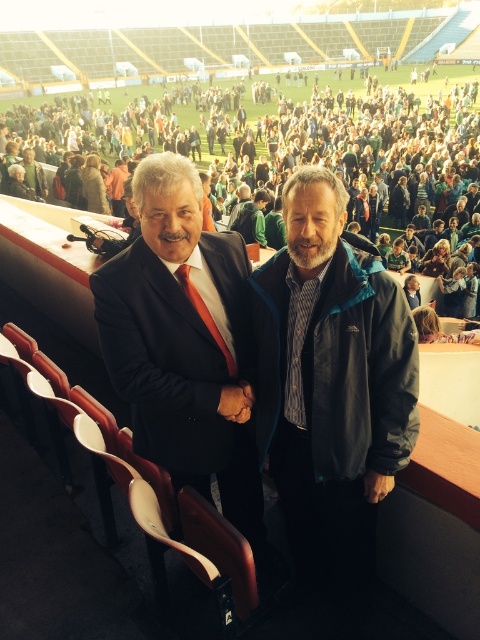
You are a photographer at the stadium and want to capture both the dark gray jacket at center and the green fabric jacket at center in a single photo. Which jacket should you position slightly to the left in your camera frame to include both?

The dark gray jacket at center is to the right of the green fabric jacket at center, so to include both in the photo, position the dark gray jacket at center slightly to the left in your camera frame.

You are a photographer at the stadium and need to capture a photo of both the dark gray jacket at center and the dark blue suit at center. Which one should you focus on first if you want to ensure both are in frame without moving the camera?

You should focus on the dark blue suit at center first because it is taller than the dark gray jacket at center, ensuring it fits within the frame when positioned properly.

You are a photographer at the stadium and want to capture a photo of both the dark gray jacket at center and the dark blue suit at center in the same frame. Based on their positions, which one should you focus on first to ensure both are in the shot?

The dark gray jacket at center is to the right of the dark blue suit at center, so you should focus on the dark blue suit at center first to include both in the frame.